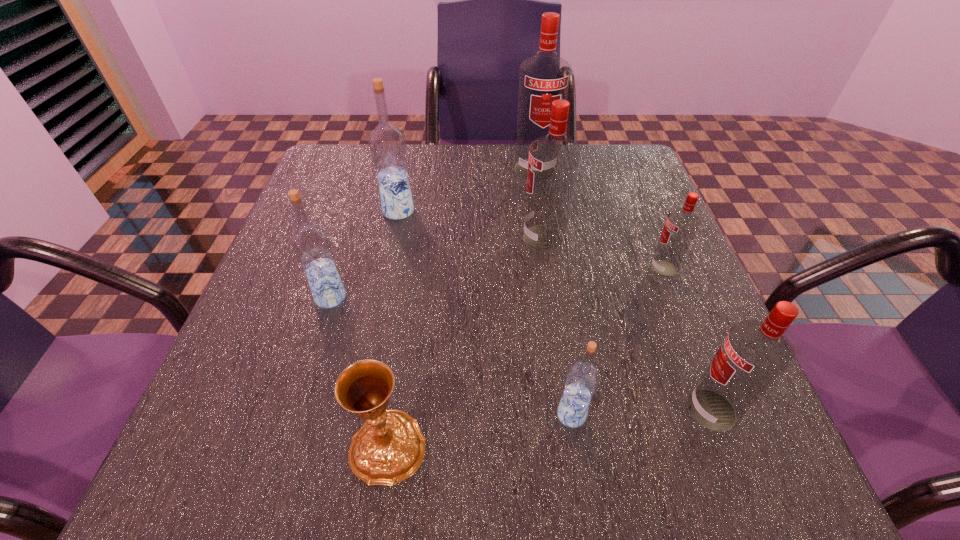
At what (x,y) coordinates should I click in order to perform the action: click on chalice situated at the near edge. Please return your answer as a coordinate pair (x, y). Image resolution: width=960 pixels, height=540 pixels. Looking at the image, I should click on (389, 447).

The height and width of the screenshot is (540, 960). In order to click on object situated at the left edge in this screenshot , I will do `click(311, 244)`.

Find the location of a particular element. The image size is (960, 540). object that is at the near right corner is located at coordinates (754, 354).

Where is `vacant space at the far edge`? The image size is (960, 540). vacant space at the far edge is located at coordinates (503, 148).

In the image, there is a desktop. Find the location of `free space at the near edge`. free space at the near edge is located at coordinates pos(428,445).

The image size is (960, 540). Find the location of `free space at the left edge`. free space at the left edge is located at coordinates (335, 231).

At what (x,y) coordinates should I click in order to perform the action: click on free space at the right edge of the desktop. Please return your answer as a coordinate pair (x, y). This screenshot has width=960, height=540. Looking at the image, I should click on (620, 225).

In the image, there is a desktop. Identify the location of free space at the far left corner. (346, 166).

Image resolution: width=960 pixels, height=540 pixels. In the image, there is a desktop. What are the coordinates of `blank space at the far right corner` in the screenshot? It's located at (585, 161).

At what (x,y) coordinates should I click in order to perform the action: click on free space that is in between the second nearest blue vodka and the second farthest object. Please return your answer as a coordinate pair (x, y). Looking at the image, I should click on (365, 254).